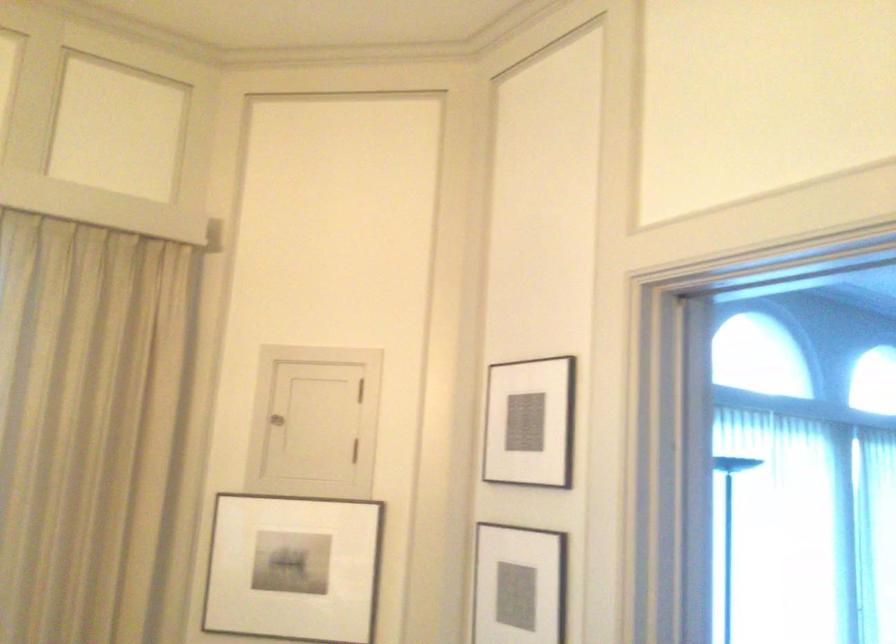
Locate an element on the screen. This screenshot has width=896, height=644. small panel lock is located at coordinates (277, 420).